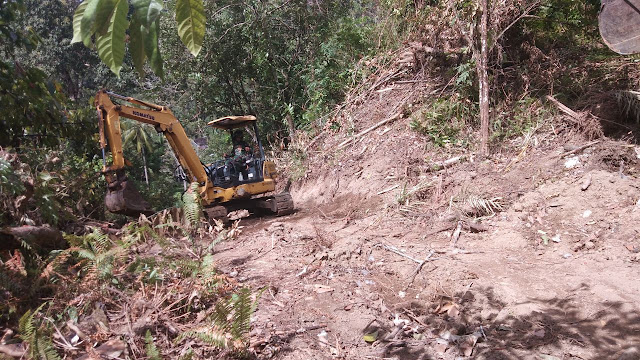
Identify the location of mirror. (621, 33).